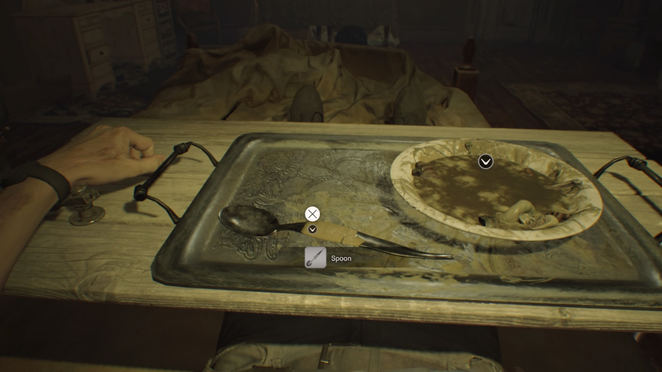
What are the coordinates of `engraved metal tray` in the screenshot? It's located at (195, 268).